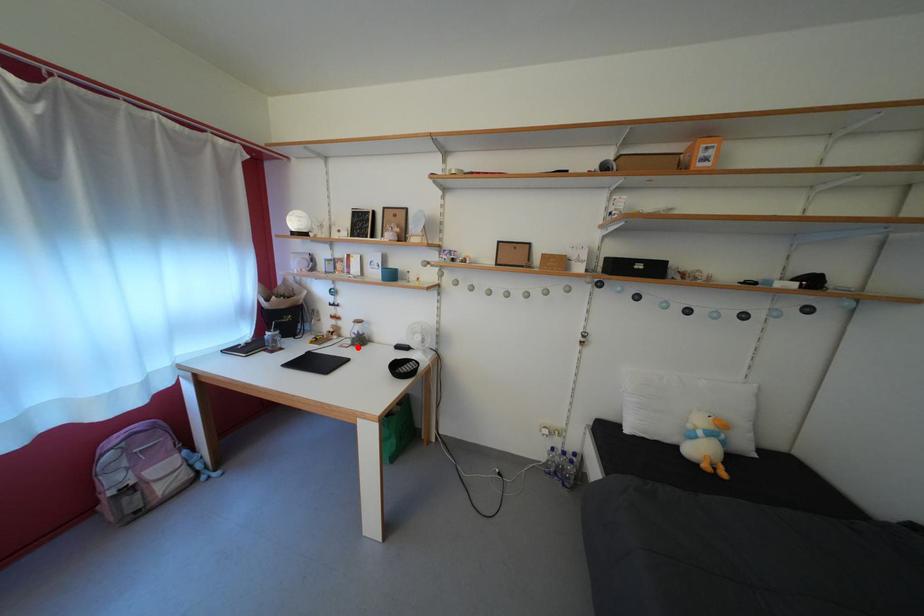
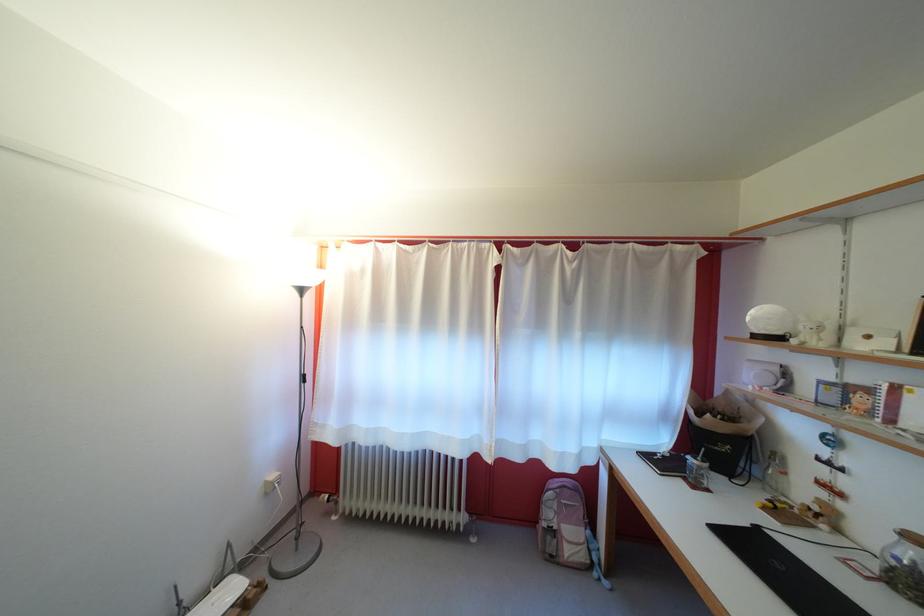
The point at the highlighted location is marked in the first image. Where is the corresponding point in the second image?

(881, 570)